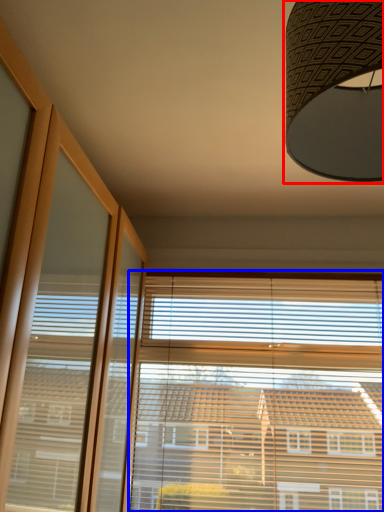
Question: Which point is further to the camera, lamp (highlighted by a red box) or bay window (highlighted by a blue box)?

Choices:
 (A) lamp
 (B) bay window

Answer: (B)